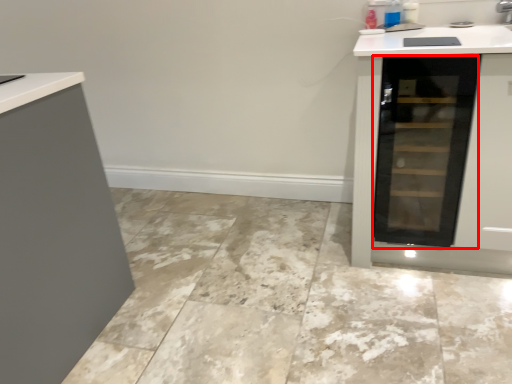
Question: From the image's perspective, where is glass door (annotated by the red box) located in relation to ceramic tile in the image?

Choices:
 (A) below
 (B) above

Answer: (B)